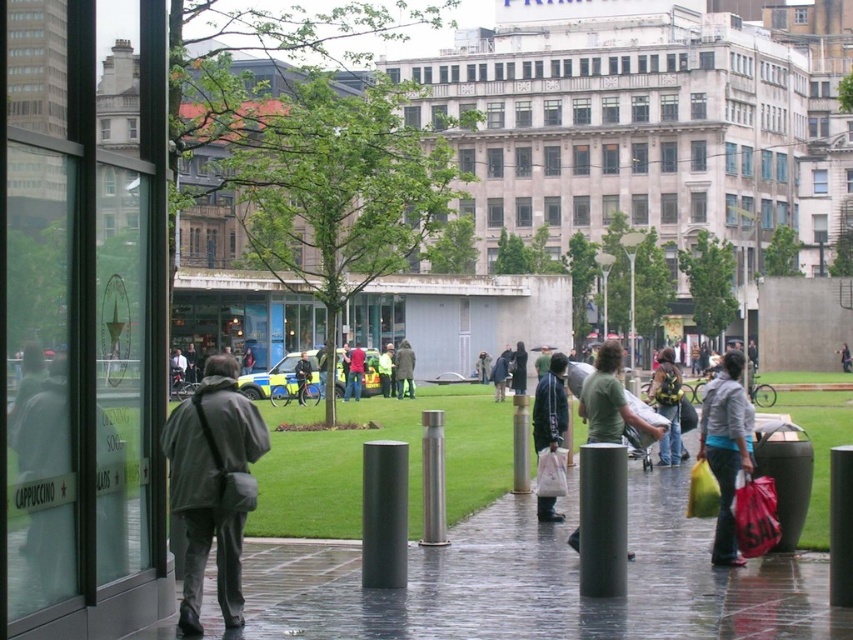
You are a delivery person trying to navigate through the scene. You need to pass between the matte black jacket at center and the satin silver pole at center. Given that your delivery cart is 1 meter wide, can you fit through the space between them?

The matte black jacket at center is larger in size than the satin silver pole at center, but the question does not provide information about the distance between them. Therefore, it is impossible to determine if the delivery cart can fit through the space.

You are a delivery person needing to place a heavy box on the ground. The shiny concrete pavement at center and the green uniform at center are both in your view. Which surface should you choose to place the box so it doesn not get wet?

The shiny concrete pavement at center is positioned under green uniform at center. Since the pavement is at the center and under the uniform, it is likely the drier surface. Place the box on the shiny concrete pavement at center to avoid wetness.